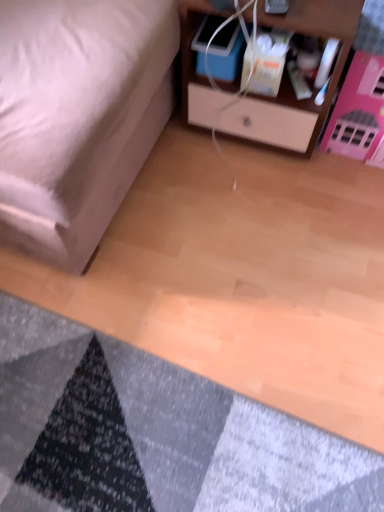
Locate an element on the screen. This screenshot has width=384, height=512. free space above textured gray mat at lower left (from a real-world perspective) is located at coordinates (97, 417).